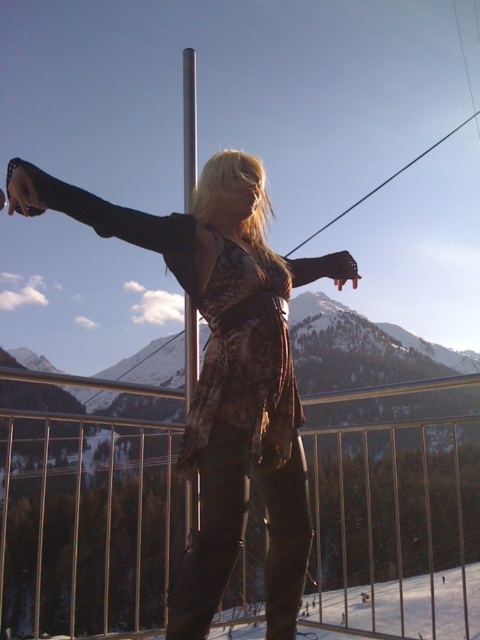
You are a photographer trying to capture a portrait of the person wearing the matte black dress at center. You want to ensure the silver metallic pole at center is not blocking the view. Can you position yourself so that the pole is out of frame? Explain your reasoning.

The matte black dress at center and silver metallic pole at center are 9.32 meters apart. Since the distance between them is significant, positioning yourself at an angle or moving slightly sideways should allow you to frame the shot without the pole obstructing the view of the dress.

You are a maintenance worker assessing the structure of the railing and pole in the image. Based on the scene, which object is taller between the metallic silver railing at center and the silver metallic pole at center?

The metallic silver railing at center is not as tall as the silver metallic pole at center, so the silver metallic pole at center is taller.

You are a photographer trying to capture a portrait of the person in the matte black dress at center. The silver metallic pole at center is blocking part of the view. Can you adjust your position to avoid the pole while still keeping the person in the frame?

The matte black dress at center is closer to the viewer than the silver metallic pole at center, so moving your position slightly to the side or adjusting the angle could allow you to capture the person without the pole blocking the view.